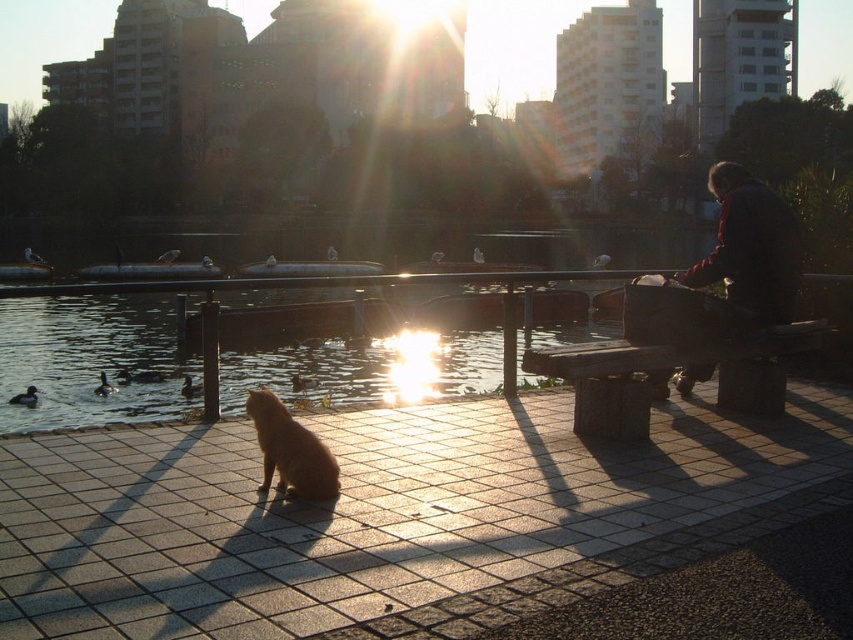
Question: Is dark brown leather jacket at upper right below golden fur cat at center?

Choices:
 (A) yes
 (B) no

Answer: (B)

Question: Which object is farther from the camera taking this photo?

Choices:
 (A) smooth stone dock at center
 (B) golden fur cat at center
 (C) dark brown leather jacket at upper right
 (D) clear water at bench right

Answer: (C)

Question: Is smooth stone dock at center in front of clear water at bench right?

Choices:
 (A) yes
 (B) no

Answer: (A)

Question: Which object appears closest to the camera in this image?

Choices:
 (A) golden fur cat at center
 (B) dark brown leather jacket at upper right

Answer: (A)

Question: Where is smooth stone dock at center located in relation to golden fur cat at center in the image?

Choices:
 (A) below
 (B) above

Answer: (A)

Question: Which is nearer to the clear water at bench right?

Choices:
 (A) dark brown leather jacket at upper right
 (B) smooth stone dock at center

Answer: (B)